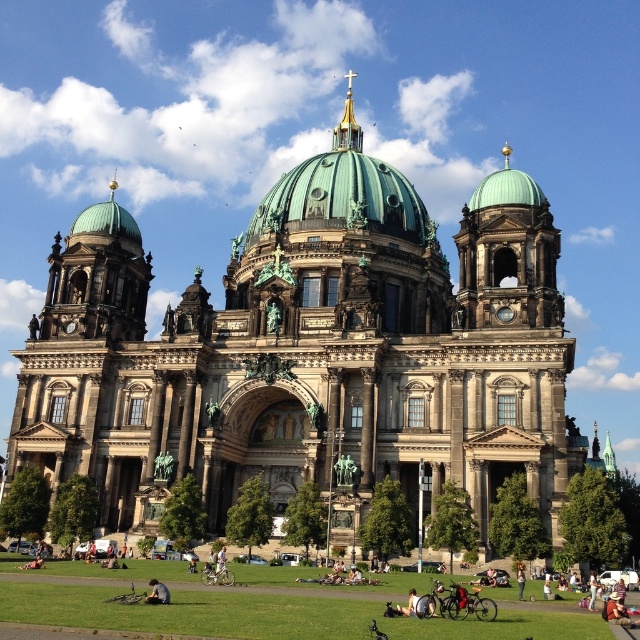
You are standing in front of the Berlin Cathedral and want to take a photo that includes both the point at coordinates point (477, 198) and point (154, 582). Which point is closer to you, making it easier to frame in the photo?

Point (477, 198) is closer to you than point (154, 582), so it will be easier to frame in the photo.

You are standing at the entrance of Berlin Cathedral and want to take a photo of the point located at coordinates point (416, 460). If your camera has a maximum focus range of 60 meters, will it be able to focus on that point?

The point (416, 460) is 59.78 meters away from the camera, which is within the maximum focus range of 60 meters. Therefore, the camera can focus on that point.

You are standing in front of the Berlin Cathedral and notice a dark gray fabric jacket at lower center. If you want to move towards the dark gray stone church at center, which direction should you walk?

The dark gray stone church at center is to the right of the dark gray fabric jacket at lower center, so you should walk to the right to move towards the dark gray stone church at center.